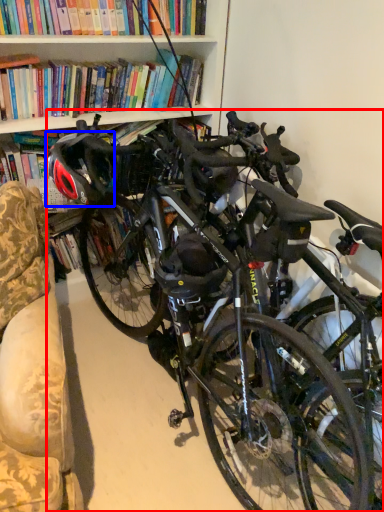
Question: Which of the following is the closest to the observer, bicycle (highlighted by a red box) or bicycle helmet (highlighted by a blue box)?

Choices:
 (A) bicycle
 (B) bicycle helmet

Answer: (A)